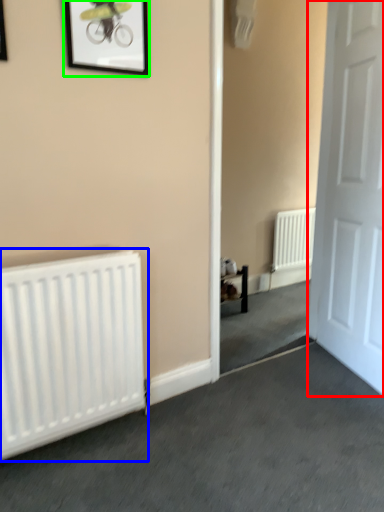
Question: Which is nearer to the door (highlighted by a red box)? radiator (highlighted by a blue box) or picture frame (highlighted by a green box).

Choices:
 (A) radiator
 (B) picture frame

Answer: (B)